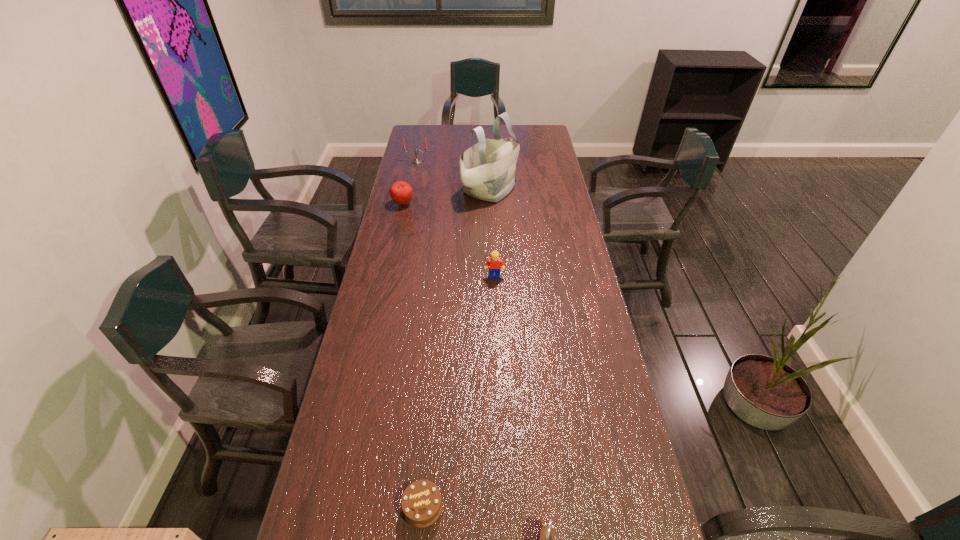
The height and width of the screenshot is (540, 960). I want to click on vacant space in between the third nearest object and the farthest object, so click(x=456, y=219).

I want to click on free spot between the fourth farthest object and the chocolate cake, so click(459, 392).

Where is `object that stands as the second closest to the shopping bag`? This screenshot has height=540, width=960. object that stands as the second closest to the shopping bag is located at coordinates (401, 192).

Identify the location of object that is the fifth nearest to the shortest object. (415, 161).

You are a GUI agent. You are given a task and a screenshot of the screen. Output one action in this format:
    pyautogui.click(x=<x>, y=<y>)
    Task: Click on the free spot that satisfies the following two spatial constraints: 1. on the front-facing side of the candle; 2. on the right side of the shortest object
    This screenshot has height=540, width=960.
    Given the screenshot: What is the action you would take?
    pyautogui.click(x=344, y=507)

Find the location of a particular element. This screenshot has width=960, height=540. vacant space that satisfies the following two spatial constraints: 1. on the front-facing side of the candle; 2. on the right side of the tallest object is located at coordinates (411, 190).